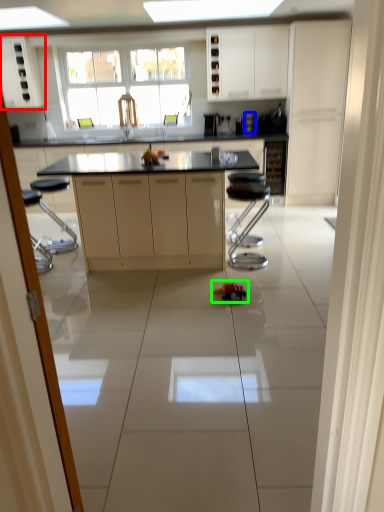
Question: Considering the real-world distances, which object is closest to cabinetry (highlighted by a red box)? appliance (highlighted by a blue box) or toy (highlighted by a green box).

Choices:
 (A) appliance
 (B) toy

Answer: (A)